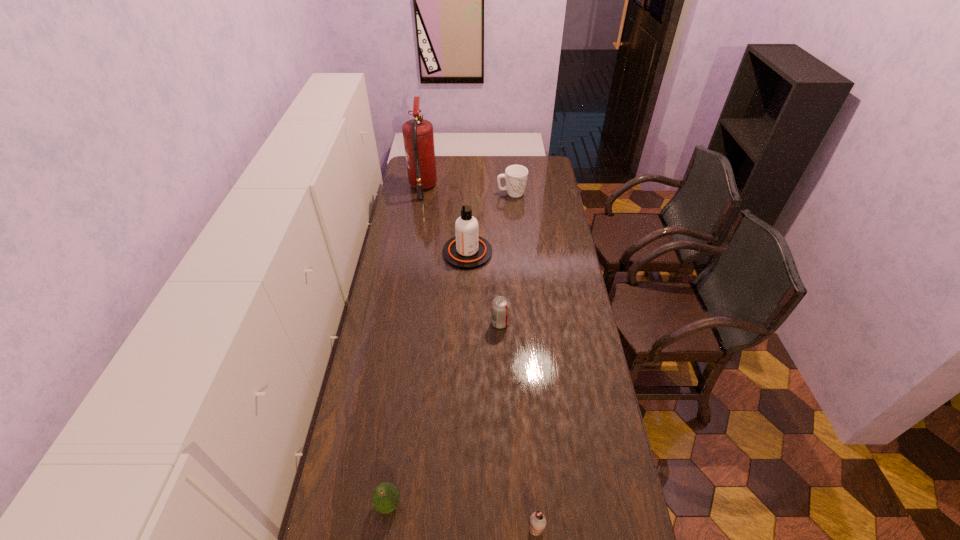
Where is `vacant space at the far right corner of the desktop`? This screenshot has height=540, width=960. vacant space at the far right corner of the desktop is located at coordinates (539, 163).

At what (x,y) coordinates should I click in order to perform the action: click on unoccupied area between the mug and the fire extinguisher. Please return your answer as a coordinate pair (x, y). Image resolution: width=960 pixels, height=540 pixels. Looking at the image, I should click on (468, 190).

Find the location of `blank region between the soda can and the fifth shortest object`. blank region between the soda can and the fifth shortest object is located at coordinates (484, 288).

Locate an element on the screen. vacant space that is in between the third nearest object and the chocolate milk is located at coordinates pos(517,426).

Image resolution: width=960 pixels, height=540 pixels. Find the location of `free point between the second tallest object and the avocado`. free point between the second tallest object and the avocado is located at coordinates (428, 378).

Image resolution: width=960 pixels, height=540 pixels. Identify the location of unoccupied area between the nearest object and the mug. (523, 361).

I want to click on vacant point located between the fifth farthest object and the soda can, so click(x=444, y=414).

Locate an element on the screen. vacant space that is in between the second nearest object and the second tallest object is located at coordinates (428, 378).

You are a GUI agent. You are given a task and a screenshot of the screen. Output one action in this format:
    pyautogui.click(x=<x>, y=<y>)
    Task: Click on the free space between the mug and the soda can
    Image resolution: width=960 pixels, height=540 pixels.
    Given the screenshot: What is the action you would take?
    pyautogui.click(x=506, y=258)

At what (x,y) coordinates should I click in order to perform the action: click on blank region between the avocado and the mug. Please return your answer as a coordinate pair (x, y). Looking at the image, I should click on (450, 349).